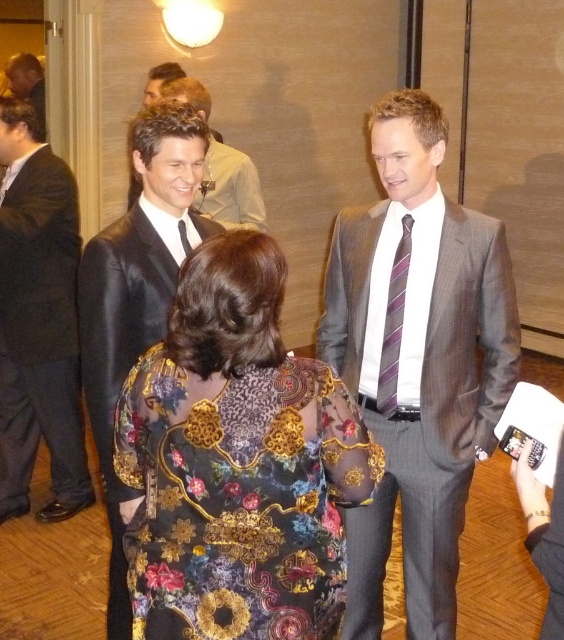
Is gray textured suit at center to the left of matte black suit at upper left from the viewer's perspective?

Incorrect, gray textured suit at center is not on the left side of matte black suit at upper left.

The image size is (564, 640). In order to click on gray textured suit at center in this screenshot , I will do `click(417, 362)`.

Does shiny black suit at left have a lesser height compared to purple striped tie at center?

No.

Is point (138, 154) positioned in front of point (380, 362)?

Yes, point (138, 154) is in front of point (380, 362).

I want to click on shiny black suit at left, so click(x=136, y=296).

Can you confirm if matte black suit at center is shorter than purple striped tie at center?

No.

Locate an element on the screen. The width and height of the screenshot is (564, 640). matte black suit at center is located at coordinates (231, 188).

Between point (196, 202) and point (396, 304), which one is positioned in front?

Positioned in front is point (396, 304).

This screenshot has height=640, width=564. In order to click on matte black suit at center in this screenshot , I will do `click(231, 188)`.